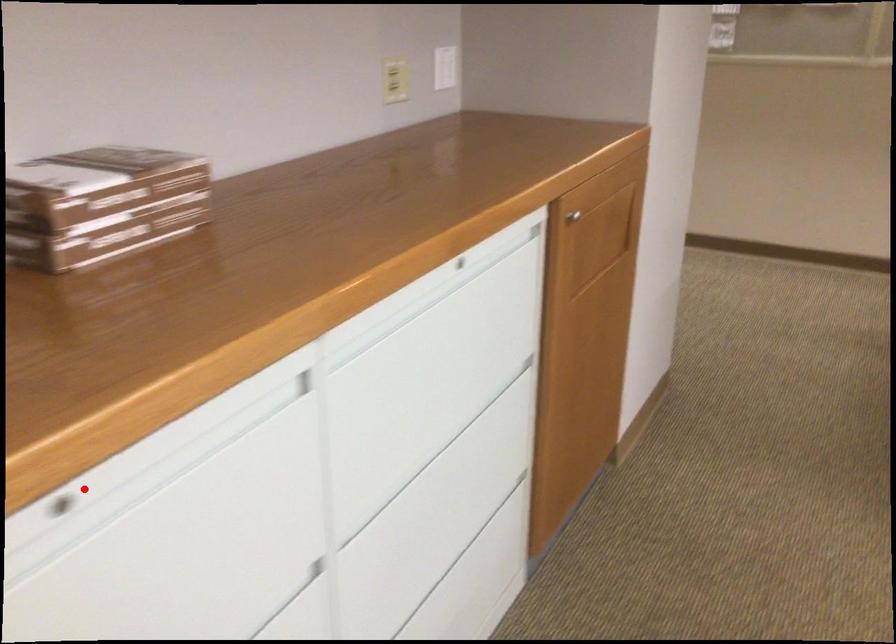
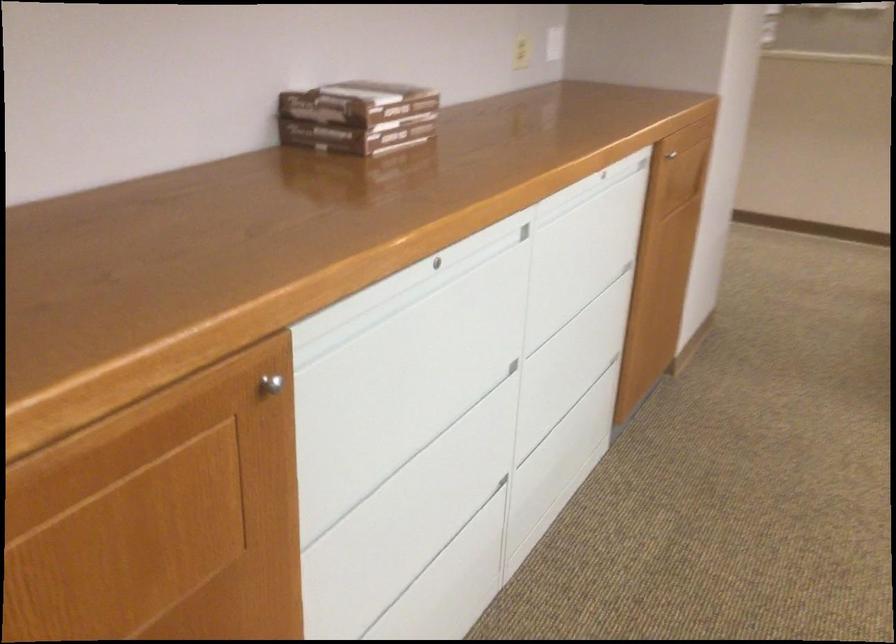
Question: I am providing you with two images of the same scene from different viewpoints. Image1 has a red point marked. In image2, the corresponding 3D location appears at what relative position? Reply with the corresponding letter.

Choices:
 (A) Closer
 (B) Farther

Answer: (B)